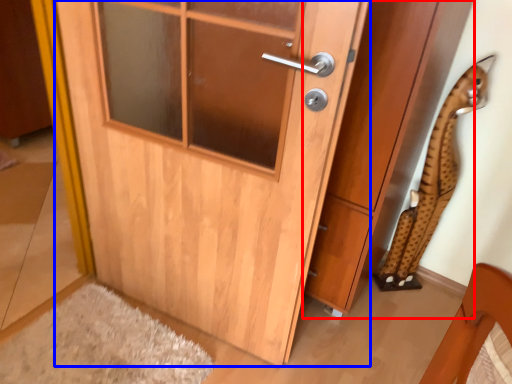
Question: Which object appears closest to the camera in this image, cabinetry (highlighted by a red box) or door (highlighted by a blue box)?

Choices:
 (A) cabinetry
 (B) door

Answer: (B)